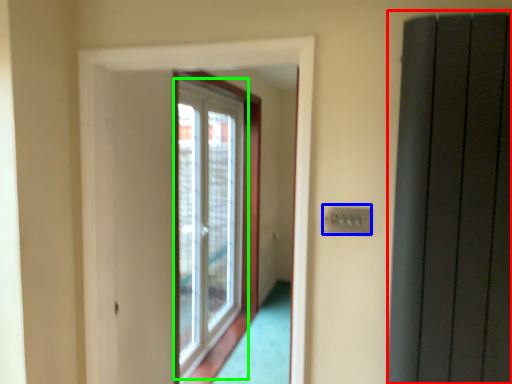
Question: Considering the real-world distances, which object is farthest from elevator (highlighted by a red box)? electric outlet (highlighted by a blue box) or window (highlighted by a green box)?

Choices:
 (A) electric outlet
 (B) window

Answer: (B)